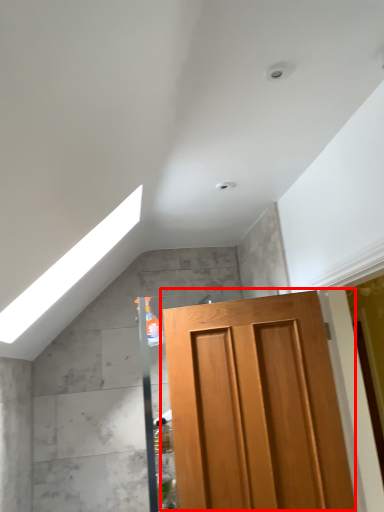
Question: Observing the image, what is the correct spatial positioning of door (annotated by the red box) in reference to exhaust hood?

Choices:
 (A) left
 (B) right

Answer: (B)